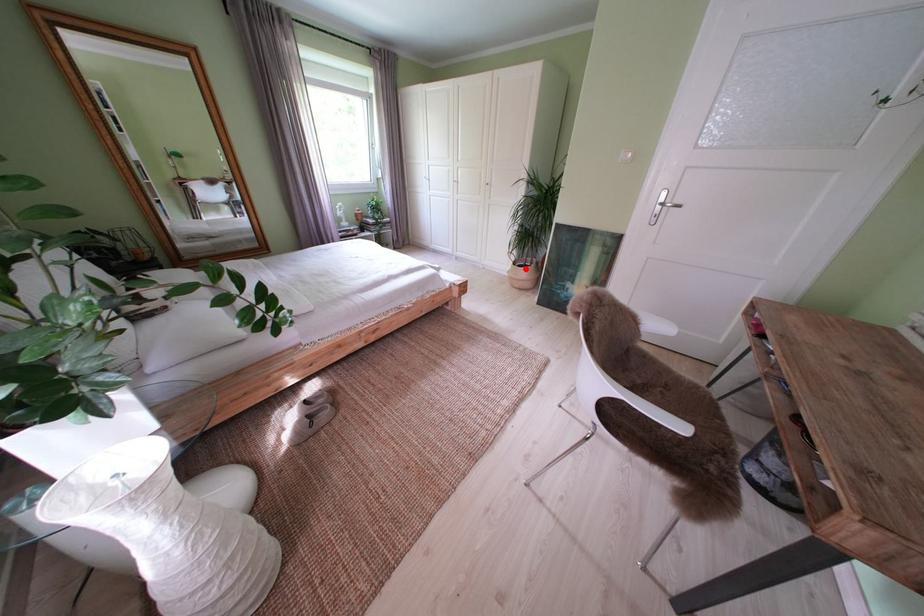
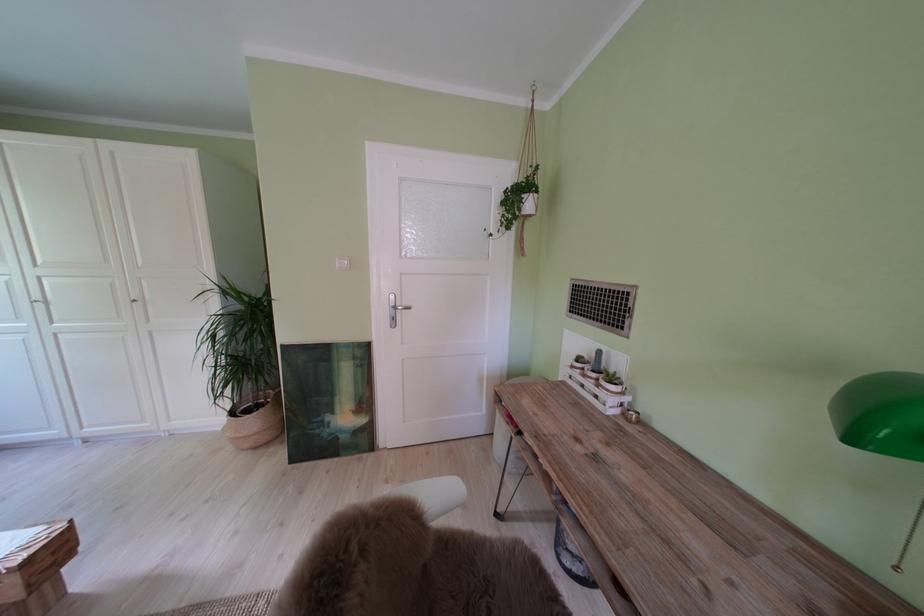
Question: I am providing you with two images of the same scene from different viewpoints. Given a red point in image1, look at the same physical point in image2. Is it:

Choices:
 (A) Closer to the viewpoint
 (B) Farther from the viewpoint

Answer: (B)